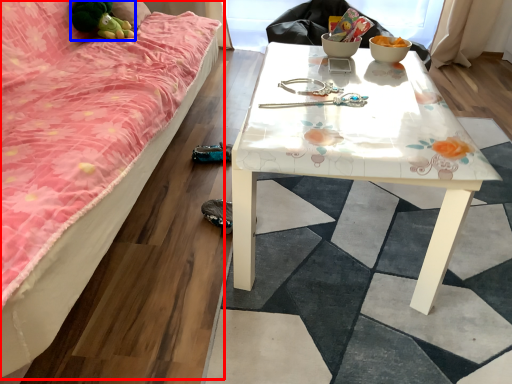
Question: Which point is further to the camera, studio couch (highlighted by a red box) or toy (highlighted by a blue box)?

Choices:
 (A) studio couch
 (B) toy

Answer: (B)